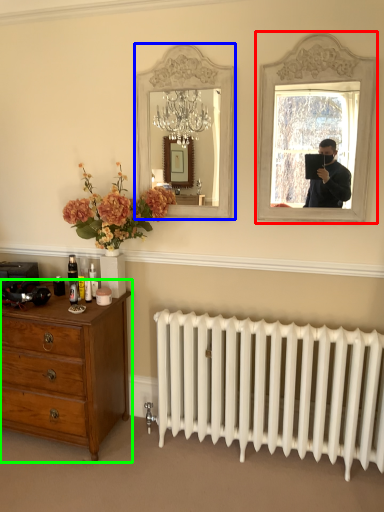
Question: Which object is the closest to the picture frame (highlighted by a red box)? Choose among these: mirror (highlighted by a blue box) or chest of drawers (highlighted by a green box).

Choices:
 (A) mirror
 (B) chest of drawers

Answer: (A)